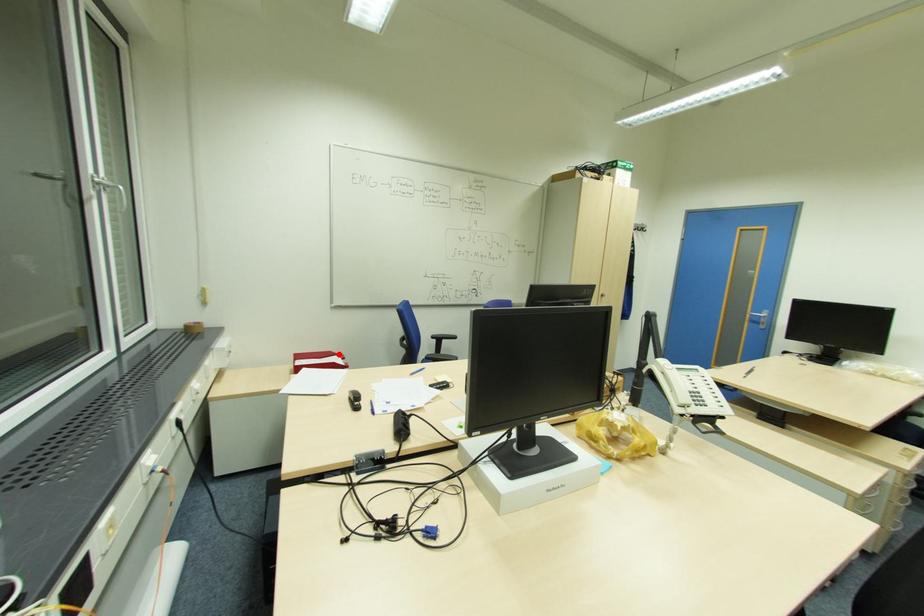
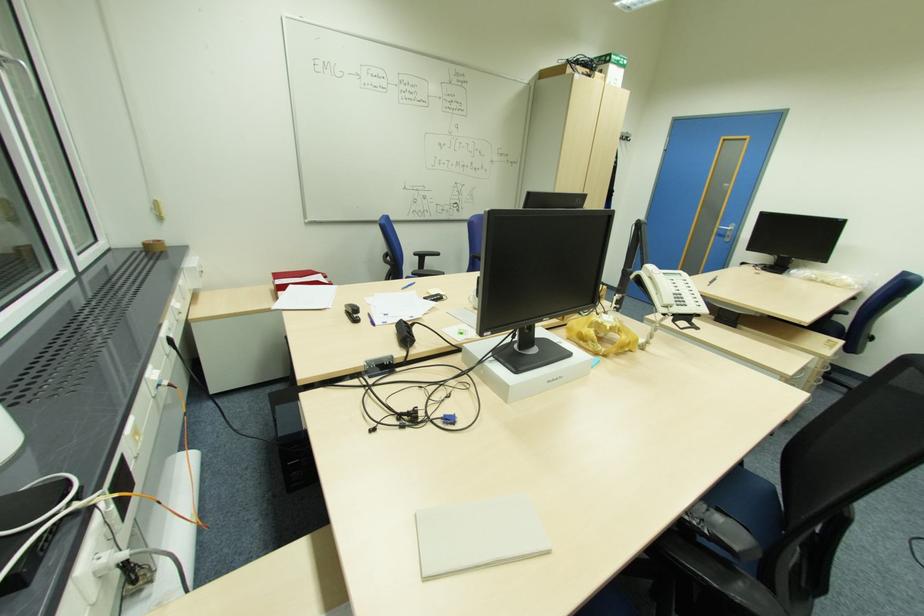
Question: I am providing you with two images of the same scene from different viewpoints. Given a red point in image1, look at the same physical point in image2. Is it:

Choices:
 (A) Closer to the viewpoint
 (B) Farther from the viewpoint

Answer: (B)